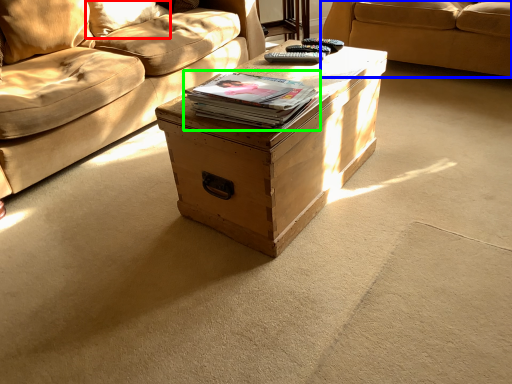
Question: Which object is positioned farthest from pillow (highlighted by a red box)? Select from studio couch (highlighted by a blue box) and paperback book (highlighted by a green box).

Choices:
 (A) studio couch
 (B) paperback book

Answer: (A)